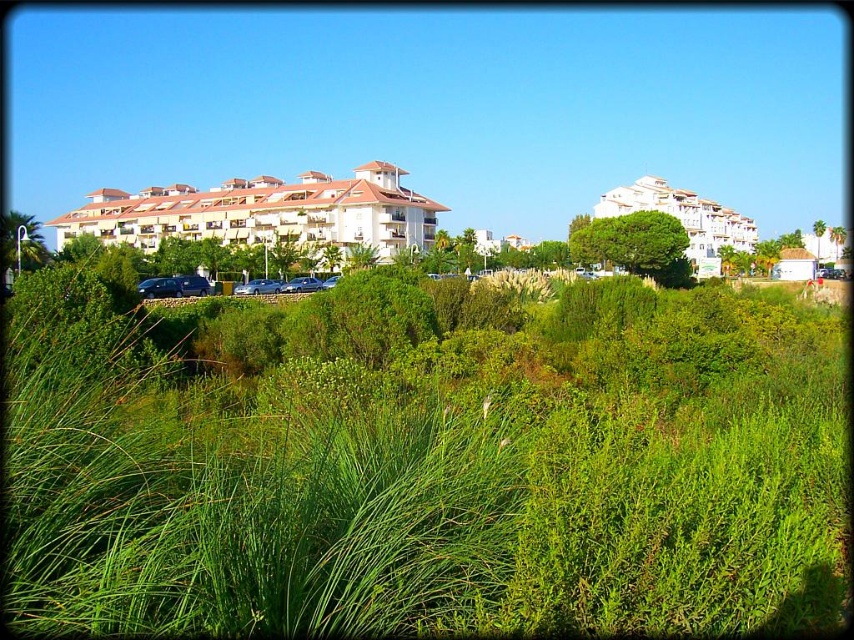
You are standing in the parking area and looking towards the green leafy palm at left and the white matte building at upper right. Which object is closer to you?

The white matte building at upper right is closer to you because the green leafy palm at left is behind it.

You are standing at the center of the parking area and looking towards the residential buildings. Which direction should you face to see the white matte building at upper right located at point (683,220)?

The white matte building at upper right is located at point (683,220), so you should face the upper right direction to see it.

Based on the photo, you are standing at the edge of the parking area and want to take a photo of both the green leafy grass at center and the white matte building at center. Which object should you position closer to the left side of your camera frame?

You should position the white matte building at center closer to the left side of your camera frame because the green leafy grass at center is to the right of it.